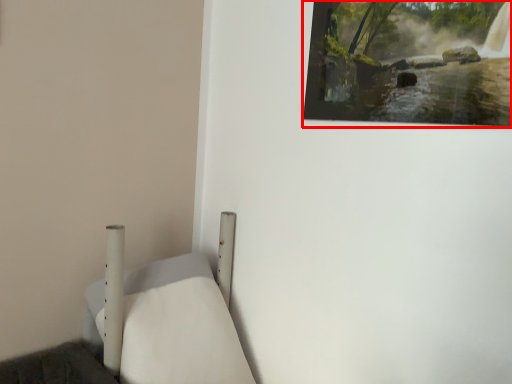
Question: From the image's perspective, what is the correct spatial positioning of picture frame (annotated by the red box) in reference to furniture?

Choices:
 (A) below
 (B) above

Answer: (B)